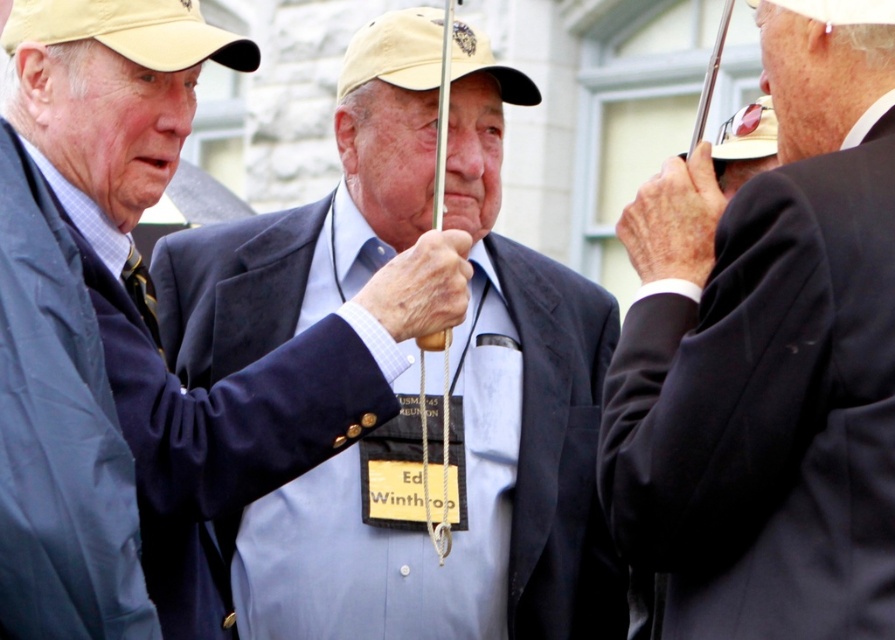
Question: Does matte blue suit at center come in front of matte black suit at center?

Choices:
 (A) no
 (B) yes

Answer: (A)

Question: Which of the following is the farthest from the observer?

Choices:
 (A) matte khaki baseball cap at center
 (B) beige fabric baseball cap at upper left
 (C) white matte baseball hat at upper right

Answer: (C)

Question: Can you confirm if matte blue suit at center is positioned below white matte baseball hat at upper right?

Choices:
 (A) yes
 (B) no

Answer: (A)

Question: Which object is positioned closest to the matte black suit at center?

Choices:
 (A) beige fabric baseball cap at upper left
 (B) white matte hat at upper right

Answer: (A)

Question: Which point is farther to the camera?

Choices:
 (A) (557, 292)
 (B) (159, 352)
 (C) (746, 115)

Answer: (C)

Question: Does matte blue suit at center lie behind matte black suit at center?

Choices:
 (A) no
 (B) yes

Answer: (B)